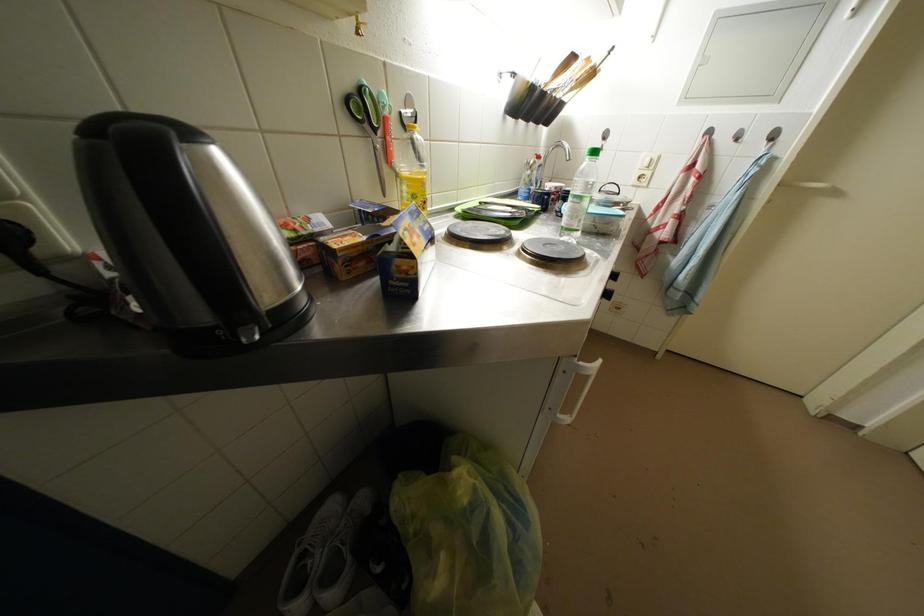
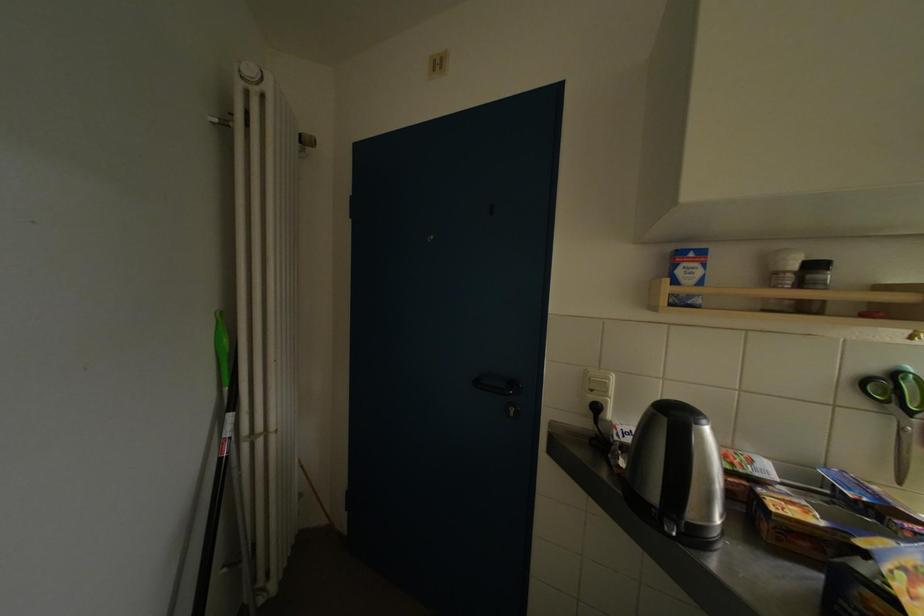
The point at (382, 152) is marked in the first image. Where is the corresponding point in the second image?

(908, 434)